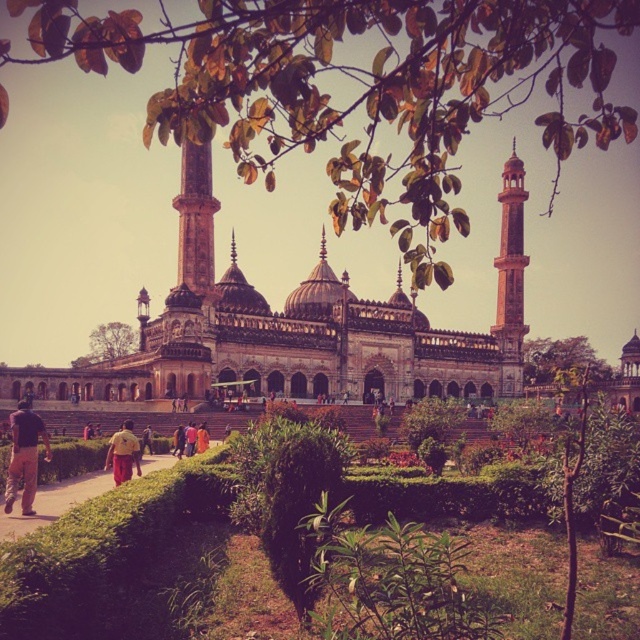
You are standing in the garden of the mosque and want to estimate how far the stone dome at center is from your current position. Based on the image, can you determine the approximate distance?

The stone dome at center is approximately 98.37 meters away from the viewer, so the distance is about 98.37 meters.

You are standing at the entrance of the mosque and want to locate the stone dome at center. According to the coordinates provided, where should you look relative to your position?

The stone dome at center is located at coordinates point (298,326), which means it is positioned slightly to the right and above your current line of sight from the entrance.

You are standing at the entrance of the grand mosque and want to reach the central dome. The brown paved path at lower center is your only path. What direction should you walk to reach the central dome?

Since the brown paved path at lower center is located at point (54, 502), which is towards the lower part of the image, you should walk upwards or towards the center of the image to reach the central dome.